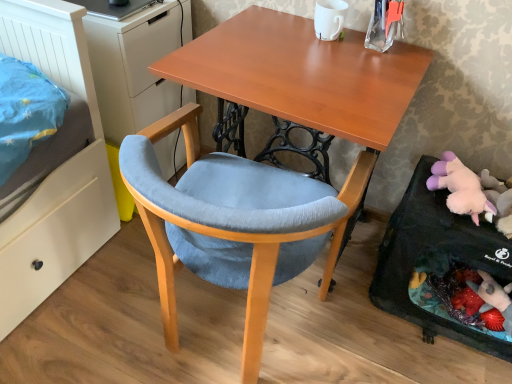
Where is `vacant region to the left of velvet blue chair at center`? vacant region to the left of velvet blue chair at center is located at coordinates (x=95, y=306).